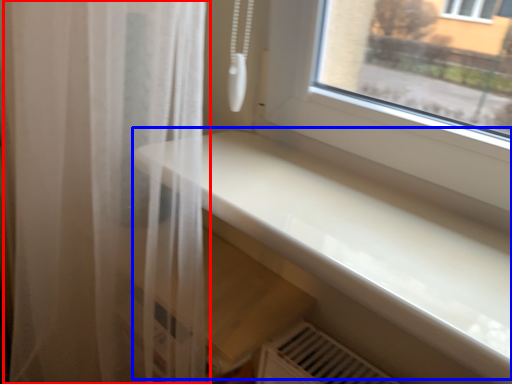
Question: Which of the following is the farthest to the observer, curtain (highlighted by a red box) or counter top (highlighted by a blue box)?

Choices:
 (A) curtain
 (B) counter top

Answer: (A)